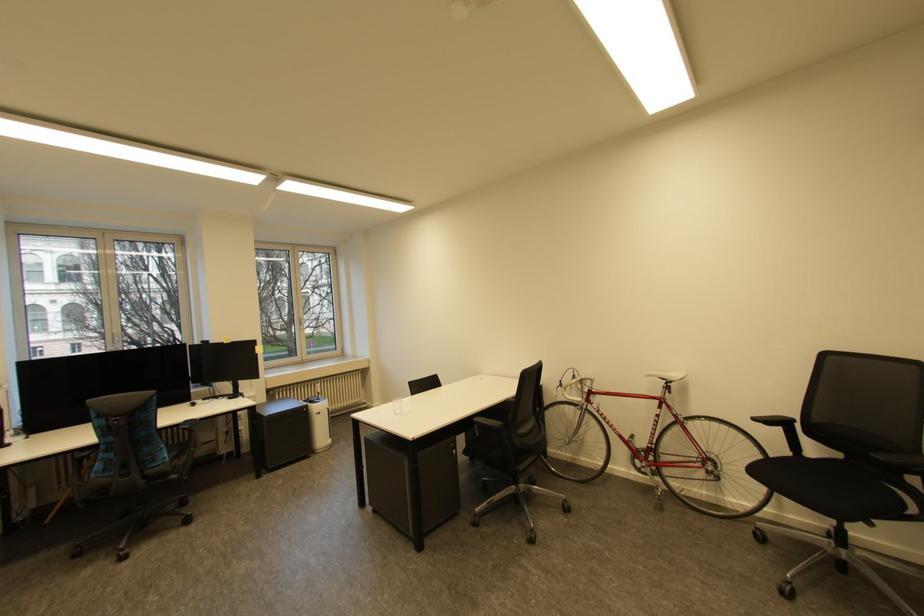
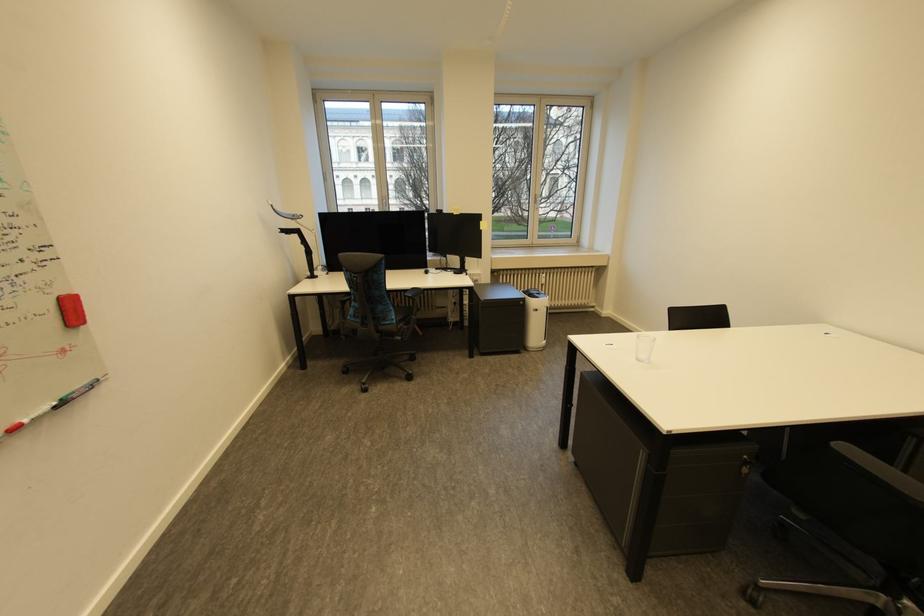
The point at (325, 414) is marked in the first image. Where is the corresponding point in the second image?

(543, 310)